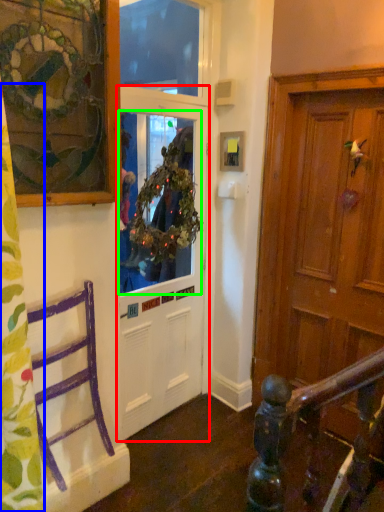
Question: Which is nearer to the door (highlighted by a red box)? curtain (highlighted by a blue box) or window screen (highlighted by a green box).

Choices:
 (A) curtain
 (B) window screen

Answer: (B)